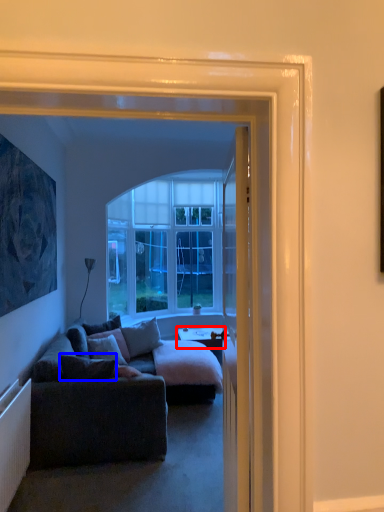
Question: Which object is closer to the camera taking this photo, desk (highlighted by a red box) or pillow (highlighted by a blue box)?

Choices:
 (A) desk
 (B) pillow

Answer: (B)